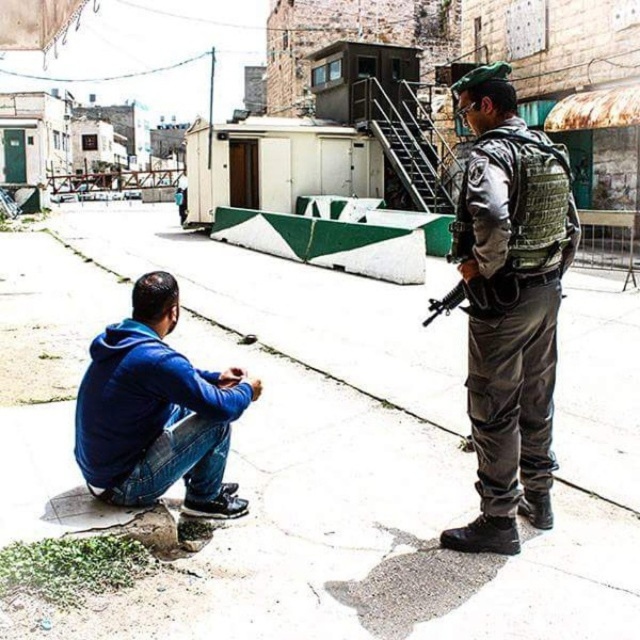
Question: Among these points, which one is farthest from the camera?

Choices:
 (A) (576, 612)
 (B) (573, 250)

Answer: (B)

Question: Which point appears farthest from the camera in this image?

Choices:
 (A) (262, 621)
 (B) (518, 497)
 (C) (134, 339)

Answer: (B)

Question: Which object is positioned closest to the camouflage fabric uniform at center?

Choices:
 (A) blue fleece jacket at lower left
 (B) smooth concrete pavement at center

Answer: (A)

Question: Can you confirm if smooth concrete pavement at center is positioned below blue fleece jacket at lower left?

Choices:
 (A) yes
 (B) no

Answer: (B)

Question: Does camouflage fabric uniform at center have a lesser width compared to blue fleece jacket at lower left?

Choices:
 (A) no
 (B) yes

Answer: (B)

Question: Can you confirm if smooth concrete pavement at center is positioned to the right of camouflage fabric uniform at center?

Choices:
 (A) no
 (B) yes

Answer: (A)